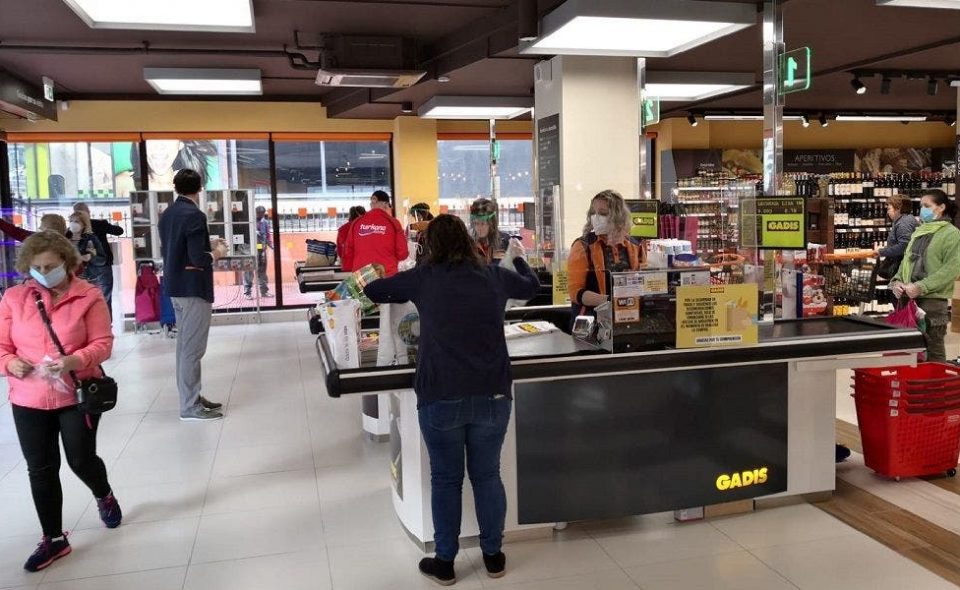
Where is `white pillar`? white pillar is located at coordinates (605, 126).